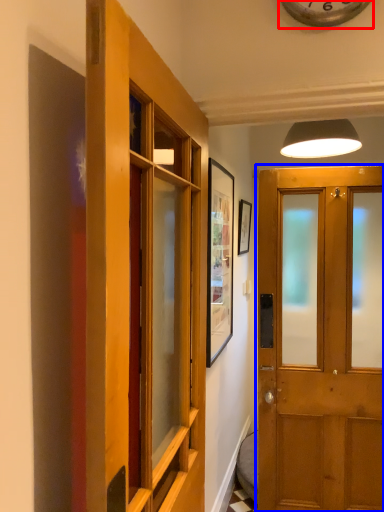
Question: Which of the following is the closest to the observer, clock (highlighted by a red box) or door (highlighted by a blue box)?

Choices:
 (A) clock
 (B) door

Answer: (B)